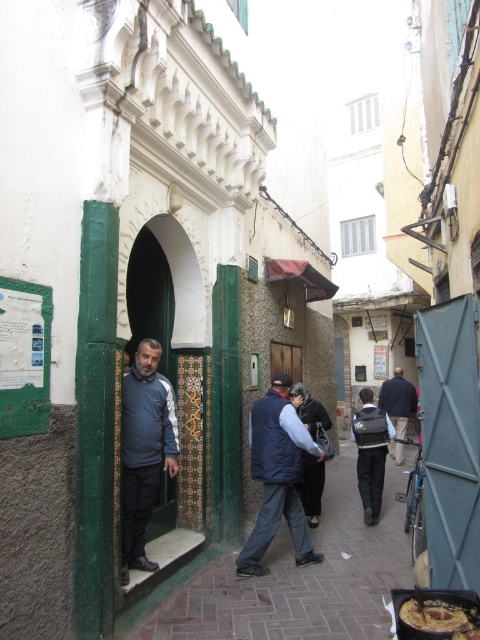
Based on the photo, you are a delivery person in a narrow alleyway with a matte blue jacket at center and a dark blue jacket at center. You need to deliver a package to the building with the green doorway on the left. Which jacket is covering the other one, making it harder to see?

The matte blue jacket at center is positioned over the dark blue jacket at center, so the matte blue jacket is covering the dark blue jacket.

Based on the photo, you are a delivery person carrying a package that requires a narrow space to pass through. You see a matte blue jacket at center and a dark blue jacket at center. Which jacket should you choose to pass through the narrow space?

The matte blue jacket at center is thinner than the dark blue jacket at center, so you should choose the matte blue jacket at center to pass through the narrow space.